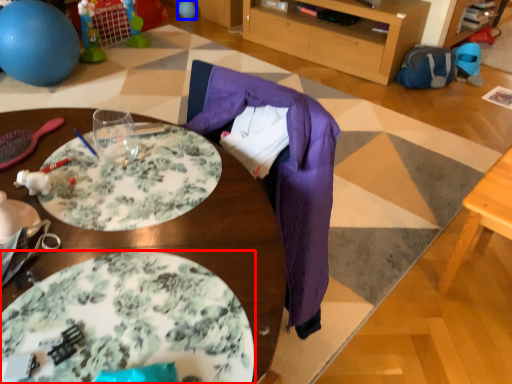
Question: Which object appears farthest to the camera in this image, plate (highlighted by a red box) or balloon (highlighted by a blue box)?

Choices:
 (A) plate
 (B) balloon

Answer: (B)